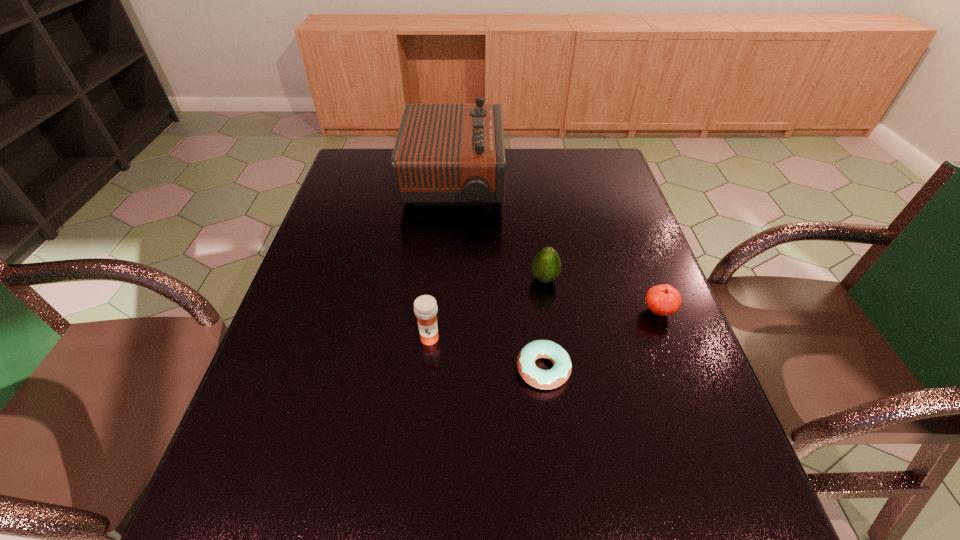
Identify the location of the tallest object. (445, 154).

Image resolution: width=960 pixels, height=540 pixels. I want to click on radio receiver, so click(x=445, y=154).

I want to click on medicine, so click(425, 307).

Where is `avocado`? The height and width of the screenshot is (540, 960). avocado is located at coordinates (546, 267).

Find the location of a particular element. This screenshot has height=540, width=960. the fourth tallest object is located at coordinates (663, 300).

Where is `the rightmost object`? Image resolution: width=960 pixels, height=540 pixels. the rightmost object is located at coordinates click(x=663, y=300).

At what (x,y) coordinates should I click in order to perform the action: click on the shortest object. Please return your answer as a coordinate pair (x, y). The height and width of the screenshot is (540, 960). Looking at the image, I should click on (542, 379).

Where is `vacant space located 0.260m on the tuning display of the tallest object`? This screenshot has width=960, height=540. vacant space located 0.260m on the tuning display of the tallest object is located at coordinates (583, 183).

I want to click on free space located on the label side of the medicine, so click(417, 467).

The image size is (960, 540). Identify the location of free space located on the back of the second farthest object. (541, 254).